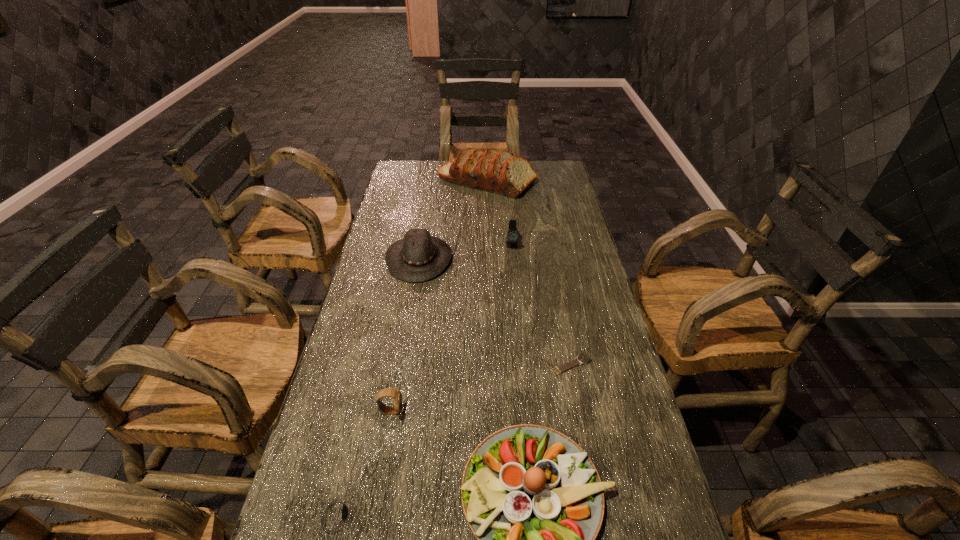
This screenshot has width=960, height=540. In order to click on vacant space at the far edge of the desktop in this screenshot , I will do `click(429, 184)`.

In the image, there is a desktop. Identify the location of vacant space at the left edge. The height and width of the screenshot is (540, 960). (368, 490).

Image resolution: width=960 pixels, height=540 pixels. I want to click on vacant area at the right edge, so click(598, 538).

The image size is (960, 540). Identify the location of vacant space at the far left corner of the desktop. (413, 171).

Locate an element on the screen. This screenshot has height=540, width=960. free space between the second farthest watch and the second tallest watch is located at coordinates (481, 388).

The image size is (960, 540). I want to click on vacant space that is in between the fourth nearest object and the tallest object, so click(x=529, y=273).

This screenshot has height=540, width=960. In order to click on free space between the third watch from left to right and the fifth tallest object in this screenshot , I will do `click(451, 328)`.

Select which object is the third closest to the salad plate. Please provide its 2D coordinates. Your answer should be formatted as a tuple, i.e. [(x, y)], where the tuple contains the x and y coordinates of a point satisfying the conditions above.

[(336, 514)]

Locate which object is the closest to the salad plate. Please provide its 2D coordinates. Your answer should be formatted as a tuple, i.e. [(x, y)], where the tuple contains the x and y coordinates of a point satisfying the conditions above.

[(387, 392)]

Locate which watch is the closest to the third farthest watch. Please provide its 2D coordinates. Your answer should be formatted as a tuple, i.e. [(x, y)], where the tuple contains the x and y coordinates of a point satisfying the conditions above.

[(336, 514)]